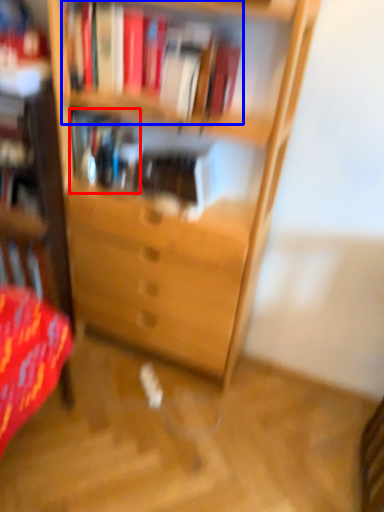
Question: Which object appears farthest to the camera in this image, book (highlighted by a red box) or book (highlighted by a blue box)?

Choices:
 (A) book
 (B) book

Answer: (A)